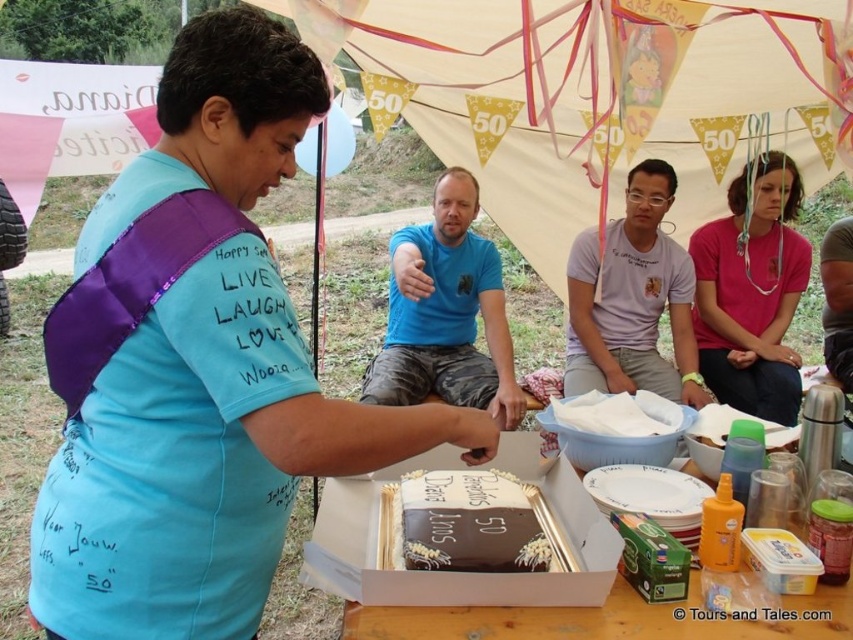
Question: Is chocolate cake at center positioned in front of chocolatesmoothcake at center?

Choices:
 (A) yes
 (B) no

Answer: (A)

Question: Which of the following is the closest to the observer?

Choices:
 (A) (514, 467)
 (B) (486, 552)

Answer: (B)

Question: Does blue t-shirt at center appear over light purple cotton shirt at center?

Choices:
 (A) yes
 (B) no

Answer: (B)

Question: Which point appears farthest from the camera in this image?

Choices:
 (A) (444, 211)
 (B) (505, 532)
 (C) (607, 330)
 (D) (627, 65)

Answer: (C)

Question: Which object is positioned closest to the white fabric tent at center?

Choices:
 (A) chocolatesmoothcake at center
 (B) chocolate cake at center

Answer: (A)

Question: Does chocolate cake at center have a greater width compared to blue t-shirt at center?

Choices:
 (A) yes
 (B) no

Answer: (A)